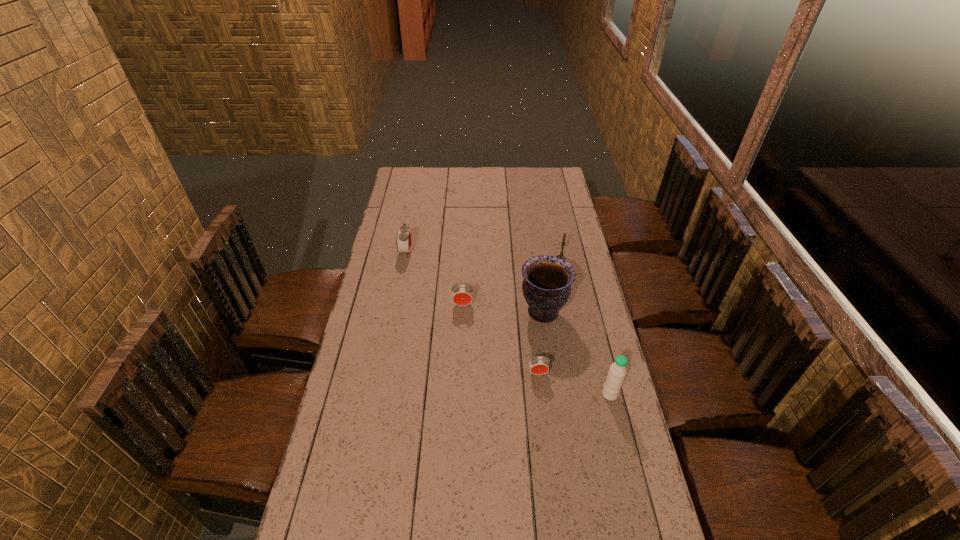
Identify the location of the leftmost object. Image resolution: width=960 pixels, height=540 pixels. (403, 240).

At what (x,y) coordinates should I click in order to perform the action: click on the tallest alarm clock. Please return your answer as a coordinate pair (x, y). This screenshot has height=540, width=960. Looking at the image, I should click on (403, 240).

Locate an element on the screen. The height and width of the screenshot is (540, 960). the fifth object from right to left is located at coordinates (462, 295).

Locate an element on the screen. the second farthest alarm clock is located at coordinates (462, 295).

The width and height of the screenshot is (960, 540). What are the coordinates of `the shortest object` in the screenshot? It's located at (538, 365).

At what (x,y) coordinates should I click in order to perform the action: click on the fifth farthest object. Please return your answer as a coordinate pair (x, y). Looking at the image, I should click on (538, 365).

At what (x,y) coordinates should I click in order to perform the action: click on candle. Please return your answer as a coordinate pair (x, y). This screenshot has width=960, height=540. Looking at the image, I should click on (561, 255).

In order to click on pottery in this screenshot , I will do `click(546, 287)`.

Locate an element on the screen. This screenshot has width=960, height=540. the rightmost object is located at coordinates (615, 378).

Image resolution: width=960 pixels, height=540 pixels. I want to click on water bottle, so click(615, 378).